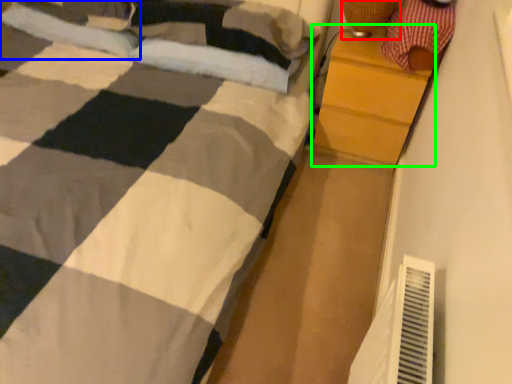
Question: Considering the real-world distances, which object is farthest from lamp (highlighted by a red box)? pillow (highlighted by a blue box) or chest of drawers (highlighted by a green box)?

Choices:
 (A) pillow
 (B) chest of drawers

Answer: (A)